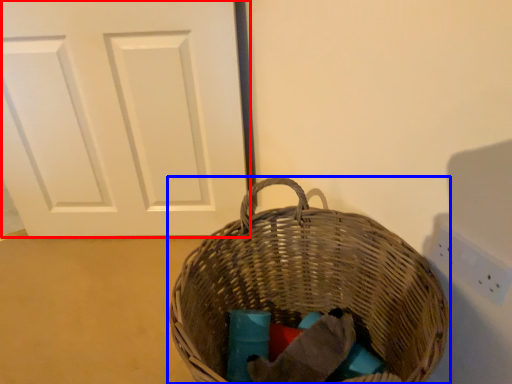
Question: Which point is further to the camera, door (highlighted by a red box) or picnic basket (highlighted by a blue box)?

Choices:
 (A) door
 (B) picnic basket

Answer: (A)